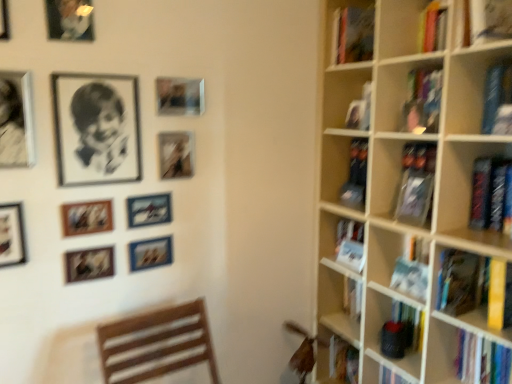
Question: Is metallic silver picture frame at upper left, the 4th picture frame viewed from the top, wider than hardcover book at right, which is the second book in bottom-to-top order?

Choices:
 (A) no
 (B) yes

Answer: (A)

Question: Is metallic silver picture frame at upper left, which ranks as the 7th picture frame in bottom-to-top order, outside of hardcover book at right, which is the second book in bottom-to-top order?

Choices:
 (A) yes
 (B) no

Answer: (A)

Question: Are metallic silver picture frame at upper left, which ranks as the 7th picture frame in bottom-to-top order, and hardcover book at right, positioned as the third book in top-to-bottom order, beside each other?

Choices:
 (A) yes
 (B) no

Answer: (B)

Question: Does metallic silver picture frame at upper left, which ranks as the 7th picture frame in bottom-to-top order, have a greater height compared to hardcover book at right, positioned as the third book in top-to-bottom order?

Choices:
 (A) no
 (B) yes

Answer: (B)

Question: Can you confirm if metallic silver picture frame at upper left, the 4th picture frame viewed from the top, is shorter than hardcover book at right, which is the second book in bottom-to-top order?

Choices:
 (A) no
 (B) yes

Answer: (A)

Question: Can you confirm if metallic silver picture frame at upper left, the 4th picture frame viewed from the top, is smaller than hardcover book at right, positioned as the third book in top-to-bottom order?

Choices:
 (A) yes
 (B) no

Answer: (A)

Question: Does metallic silver photo frame at center-left, arranged as the second picture frame when ordered from the bottom, have a lesser height compared to black and white portrait at upper left?

Choices:
 (A) no
 (B) yes

Answer: (B)

Question: Is metallic silver photo frame at center-left, arranged as the second picture frame when ordered from the bottom, in contact with black and white portrait at upper left?

Choices:
 (A) yes
 (B) no

Answer: (B)

Question: Considering the relative positions of metallic silver photo frame at center-left, arranged as the second picture frame when ordered from the bottom, and black and white portrait at upper left in the image provided, is metallic silver photo frame at center-left, arranged as the second picture frame when ordered from the bottom, to the right of black and white portrait at upper left from the viewer's perspective?

Choices:
 (A) yes
 (B) no

Answer: (A)

Question: Is metallic silver photo frame at center-left, arranged as the second picture frame when ordered from the bottom, further to camera compared to black and white portrait at upper left?

Choices:
 (A) no
 (B) yes

Answer: (B)

Question: From the image's perspective, is metallic silver photo frame at center-left, arranged as the ninth picture frame when viewed from the top, located beneath black and white portrait at upper left?

Choices:
 (A) no
 (B) yes

Answer: (B)

Question: Is metallic silver photo frame at center-left, arranged as the second picture frame when ordered from the bottom, thinner than black and white portrait at upper left?

Choices:
 (A) yes
 (B) no

Answer: (A)

Question: Considering the relative sizes of black and white portrait at upper left and metallic silver picture frame at upper left, which ranks as the ninth picture frame in bottom-to-top order, in the image provided, is black and white portrait at upper left wider than metallic silver picture frame at upper left, which ranks as the ninth picture frame in bottom-to-top order,?

Choices:
 (A) no
 (B) yes

Answer: (B)